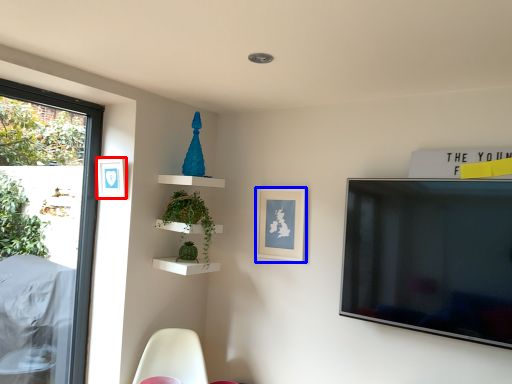
Question: Which point is further to the camera, picture frame (highlighted by a red box) or picture frame (highlighted by a blue box)?

Choices:
 (A) picture frame
 (B) picture frame

Answer: (B)